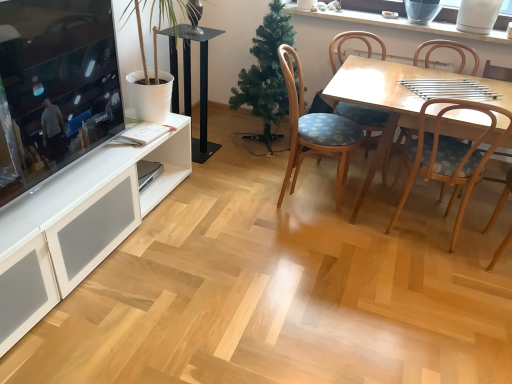
Question: From a real-world perspective, is green matte christmas tree at center physically located above or below wooden chair with floral cushion at center, which ranks as the 3th chair in right-to-left order?

Choices:
 (A) below
 (B) above

Answer: (B)

Question: Does point (287, 107) appear closer or farther from the camera than point (381, 112)?

Choices:
 (A) farther
 (B) closer

Answer: (A)

Question: Which of these objects is positioned farthest from the matte black television at left?

Choices:
 (A) blue fabric chair at center, positioned as the first chair in left-to-right order
 (B) white ceramic vase at upper center
 (C) wooden chair with floral cushion at center, which ranks as the 3th chair in right-to-left order
 (D) black glass speaker at center
 (E) wooden chair with floral cushion at center, the 1th chair when ordered from right to left

Answer: (E)

Question: Considering the real-world distances, which object is closest to the black glass speaker at center?

Choices:
 (A) wooden chair with blue cushion at center-right, which is the second chair from right to left
 (B) green matte christmas tree at center
 (C) light wood table at center
 (D) wooden chair with floral cushion at center, the fourth chair positioned from the left
 (E) white ceramic vase at upper center

Answer: (B)